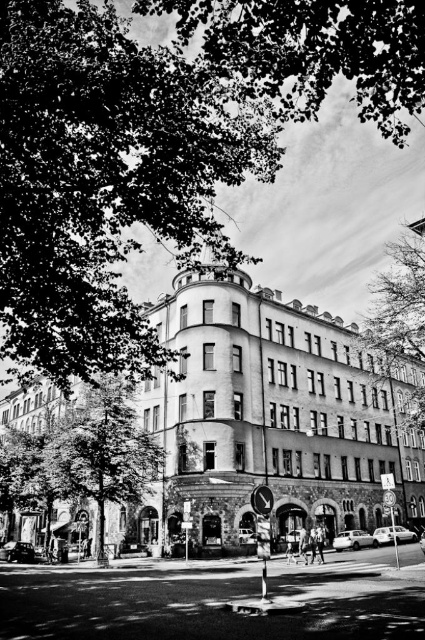
Question: Does green leafy tree at center appear on the left side of green leafy tree at upper right?

Choices:
 (A) yes
 (B) no

Answer: (A)

Question: Estimate the real-world distances between objects in this image. Which object is farther from the green leafy tree at upper right?

Choices:
 (A) dark green leafy tree at upper center
 (B) green leafy tree at upper left
 (C) green leafy tree at center

Answer: (C)

Question: Which object is farther from the camera taking this photo?

Choices:
 (A) green leafy tree at upper right
 (B) green leafy tree at center
 (C) green leafy tree at upper left

Answer: (A)

Question: Which object is positioned farthest from the green leafy tree at upper right?

Choices:
 (A) dark green leafy tree at upper center
 (B) green leafy tree at center

Answer: (B)

Question: Can you confirm if green leafy tree at upper left is thinner than dark green leafy tree at upper center?

Choices:
 (A) yes
 (B) no

Answer: (B)

Question: Can you confirm if green leafy tree at upper left is wider than dark green leafy tree at upper center?

Choices:
 (A) no
 (B) yes

Answer: (B)